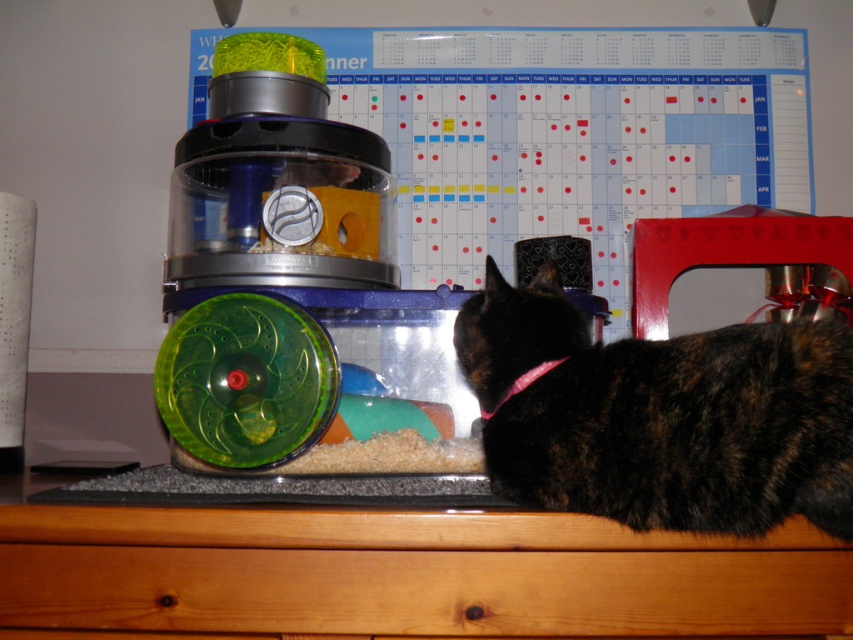
Is wooden drawer at lower center behind tortoiseshell fur at right?

Yes, wooden drawer at lower center is behind tortoiseshell fur at right.

Does wooden drawer at lower center have a greater width compared to tortoiseshell fur at right?

Indeed, wooden drawer at lower center has a greater width compared to tortoiseshell fur at right.

The image size is (853, 640). Identify the location of wooden drawer at lower center. (408, 573).

Locate an element on the screen. This screenshot has height=640, width=853. wooden drawer at lower center is located at coordinates (408, 573).